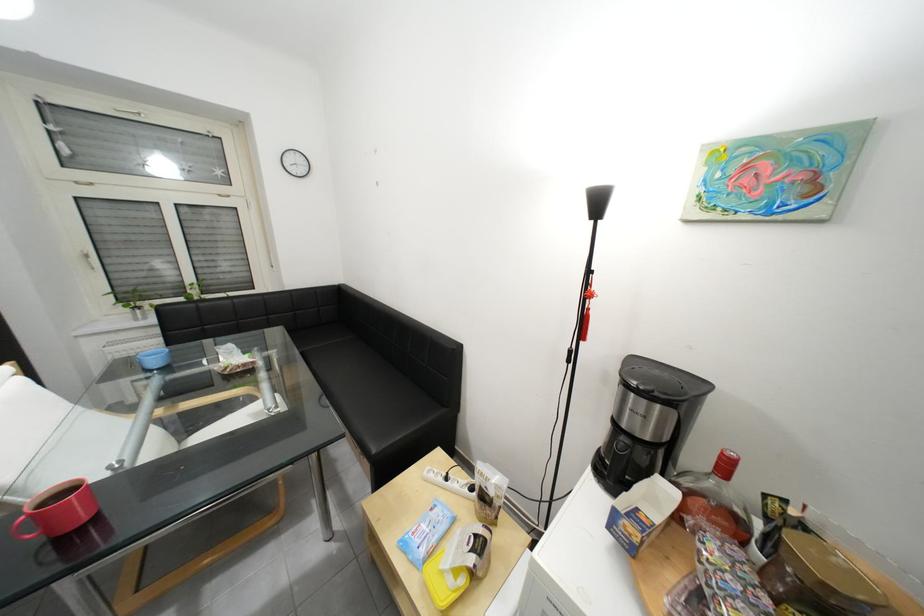
Locate an element on the screen. white window handle is located at coordinates (88, 259).